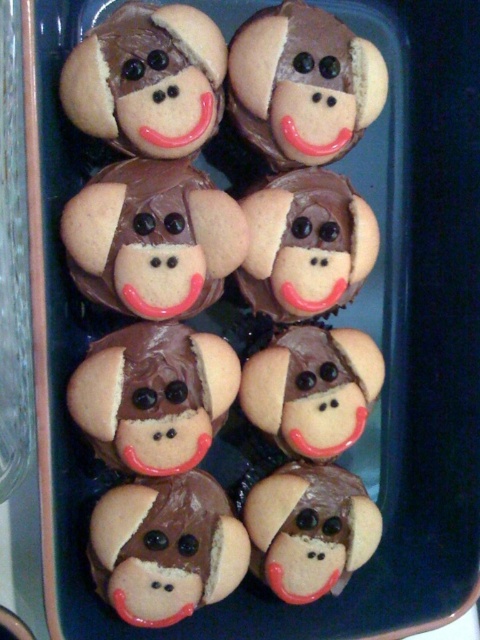
You are a baker who needs to place a matte brown cookie at center on the left side of a matte chocolate monkey face at center. Is the current arrangement of the cupcakes in the dark blue container already meeting this requirement?

The matte chocolate monkey face at center is positioned on the right side of the matte brown cookie at center, so the current arrangement does not meet the requirement since the cookie is already on the left side of the monkey face. To fulfill the requirement, the cookie needs to be moved further to the left so that the monkey face is on its right side.

You are a customer at a bakery and see the cupcakes arranged in a dark blue rectangular container. There is a point marked at coordinates (x=313, y=88). Which cupcake feature is located at this point?

The point at coordinates (x=313, y=88) indicates the matte chocolate monkey face at center.